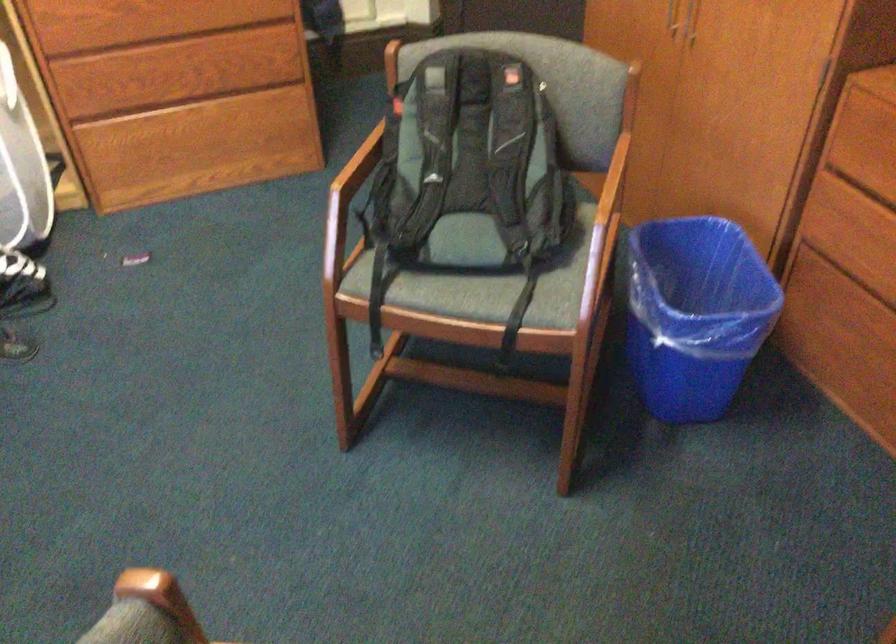
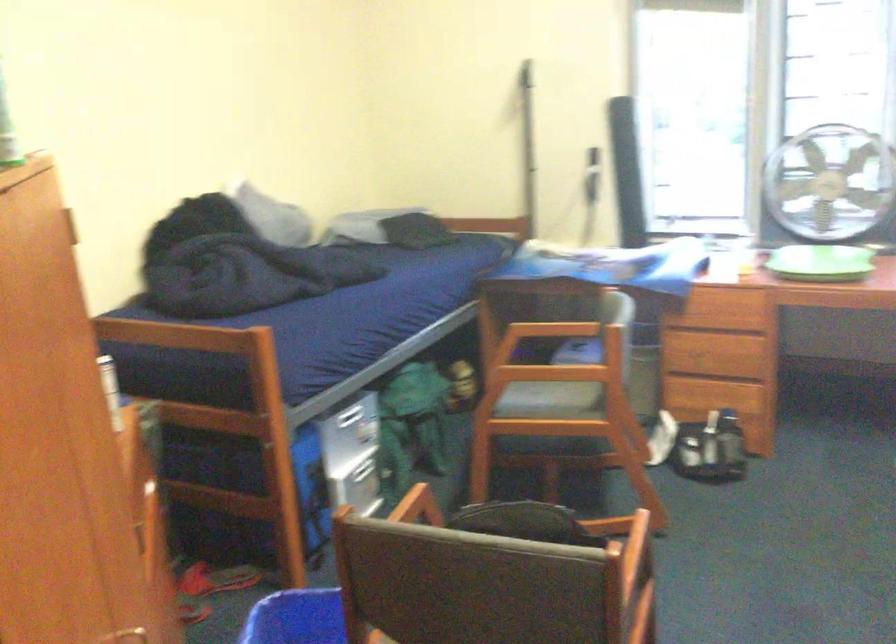
Where in the second image is the point corresponding to pixel 580 243 from the first image?

(418, 506)